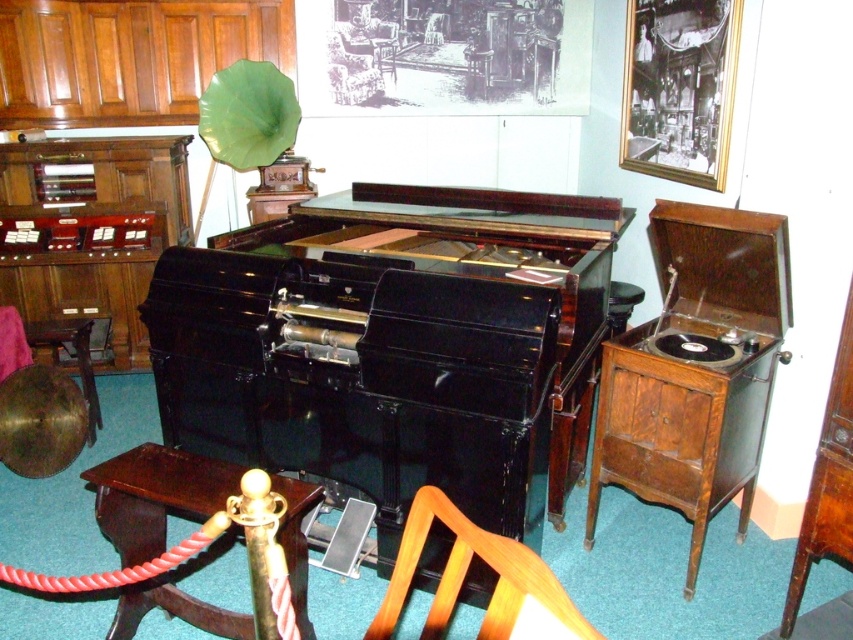
Question: Is wooden chair at lower center closer to the viewer compared to brown wood drawer at lower right?

Choices:
 (A) yes
 (B) no

Answer: (A)

Question: Considering the relative positions of wooden chair at lower center and brown wood drawer at lower right in the image provided, where is wooden chair at lower center located with respect to brown wood drawer at lower right?

Choices:
 (A) below
 (B) above

Answer: (B)

Question: Estimate the real-world distances between objects in this image. Which object is closer to the wooden chair at lower center?

Choices:
 (A) wooden drawer at lower right
 (B) brown polished wood table at lower left
 (C) glossy black piano at center

Answer: (B)

Question: Is wooden/carved record player at right to the right of brown polished wood table at lower left from the viewer's perspective?

Choices:
 (A) no
 (B) yes

Answer: (B)

Question: Which object is the closest to the wooden drawer at lower right?

Choices:
 (A) brown polished wood table at lower left
 (B) wooden chair at lower center
 (C) wooden/carved record player at right

Answer: (C)

Question: Which object is the closest to the wooden chair at lower center?

Choices:
 (A) brown wood drawer at lower right
 (B) glossy black piano at center
 (C) wooden/carved record player at right
 (D) brown polished wood table at lower left

Answer: (D)